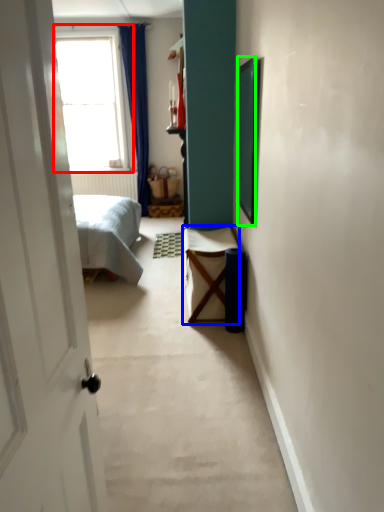
Question: Which is nearer to the window (highlighted by a red box)? furniture (highlighted by a blue box) or picture frame (highlighted by a green box).

Choices:
 (A) furniture
 (B) picture frame

Answer: (A)